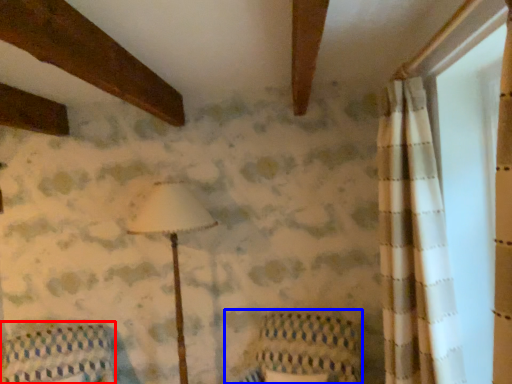
Question: Among these objects, which one is nearest to the camera, furniture (highlighted by a red box) or armchair (highlighted by a blue box)?

Choices:
 (A) furniture
 (B) armchair

Answer: (B)